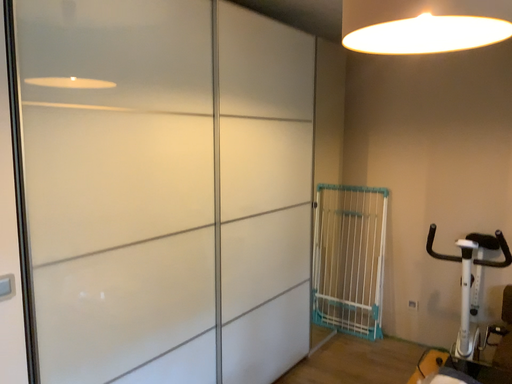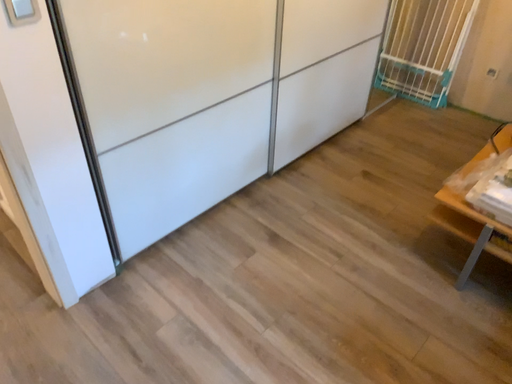
Question: Which way did the camera rotate in the video?

Choices:
 (A) rotated downward
 (B) rotated upward

Answer: (A)